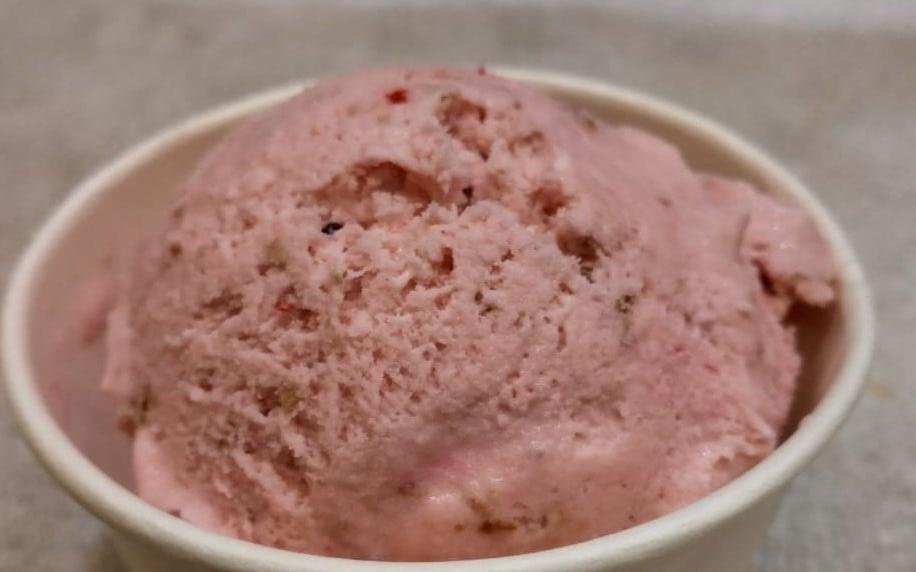
Image resolution: width=916 pixels, height=572 pixels. Find the location of `right side of bowl`. right side of bowl is located at coordinates (758, 535).